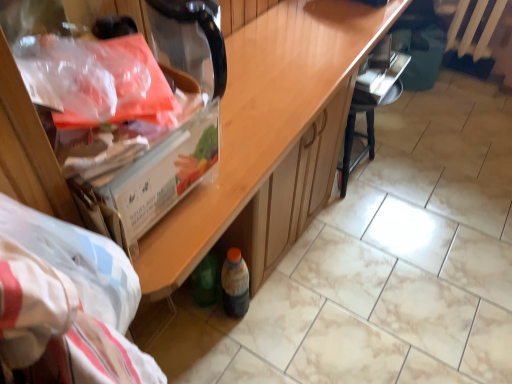
Question: Could you tell me if translucent plastic bottle at lower center is turned towards translucent plastic bag at upper left?

Choices:
 (A) yes
 (B) no

Answer: (B)

Question: Is translucent plastic bottle at lower center to the right of translucent plastic bag at upper left from the viewer's perspective?

Choices:
 (A) no
 (B) yes

Answer: (B)

Question: Is translucent plastic bottle at lower center in front of translucent plastic bag at upper left?

Choices:
 (A) no
 (B) yes

Answer: (A)

Question: Does translucent plastic bottle at lower center have a lesser height compared to translucent plastic bag at upper left?

Choices:
 (A) yes
 (B) no

Answer: (B)

Question: Can we say translucent plastic bottle at lower center lies outside translucent plastic bag at upper left?

Choices:
 (A) yes
 (B) no

Answer: (A)

Question: Is black wood chair at center situated inside translucent plastic bag at upper left or outside?

Choices:
 (A) outside
 (B) inside

Answer: (A)

Question: In terms of size, does black wood chair at center appear bigger or smaller than translucent plastic bag at upper left?

Choices:
 (A) small
 (B) big

Answer: (B)

Question: From the image's perspective, is black wood chair at center positioned above or below translucent plastic bag at upper left?

Choices:
 (A) below
 (B) above

Answer: (B)

Question: Considering their positions, is black wood chair at center located in front of or behind translucent plastic bag at upper left?

Choices:
 (A) behind
 (B) front

Answer: (A)

Question: Based on their sizes in the image, would you say translucent plastic bottle at lower center is bigger or smaller than metallic silver radiator at upper right?

Choices:
 (A) small
 (B) big

Answer: (A)

Question: Is point (228, 289) positioned closer to the camera than point (501, 8)?

Choices:
 (A) closer
 (B) farther

Answer: (A)

Question: In terms of height, does translucent plastic bottle at lower center look taller or shorter compared to metallic silver radiator at upper right?

Choices:
 (A) short
 (B) tall

Answer: (A)

Question: From the image's perspective, relative to metallic silver radiator at upper right, is translucent plastic bottle at lower center above or below?

Choices:
 (A) above
 (B) below

Answer: (B)

Question: In terms of size, does translucent plastic bag at upper left appear bigger or smaller than black wood chair at center?

Choices:
 (A) small
 (B) big

Answer: (A)

Question: In terms of width, does translucent plastic bag at upper left look wider or thinner when compared to black wood chair at center?

Choices:
 (A) wide
 (B) thin

Answer: (A)